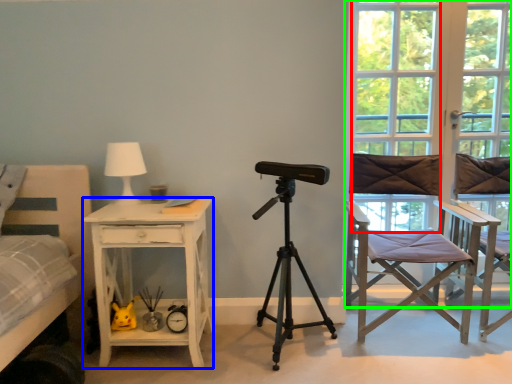
Question: Which object is positioned farthest from window (highlighted by a red box)? Select from desk (highlighted by a blue box) and window frame (highlighted by a green box).

Choices:
 (A) desk
 (B) window frame

Answer: (A)